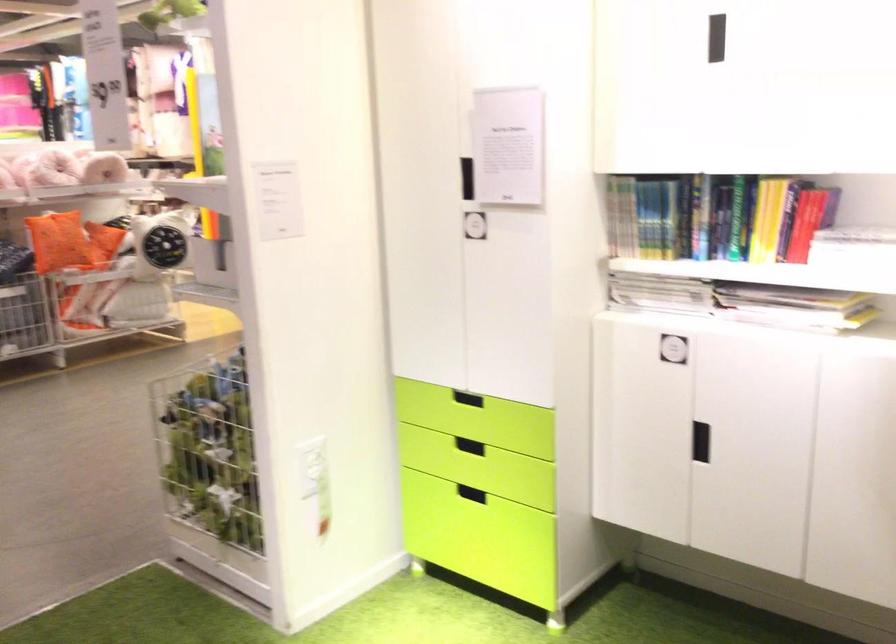
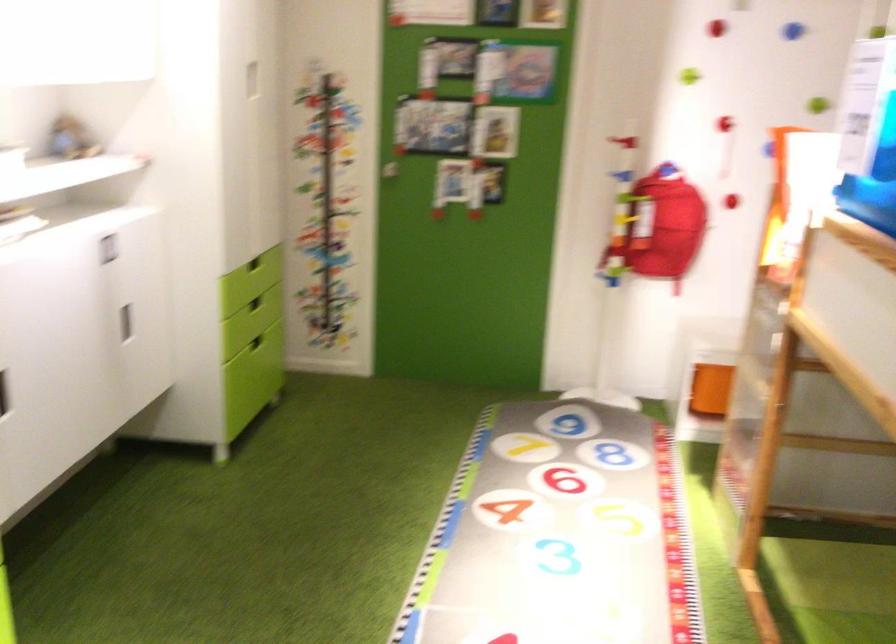
In the second image, find the point that corresponds to point 675,428 in the first image.

(3, 393)